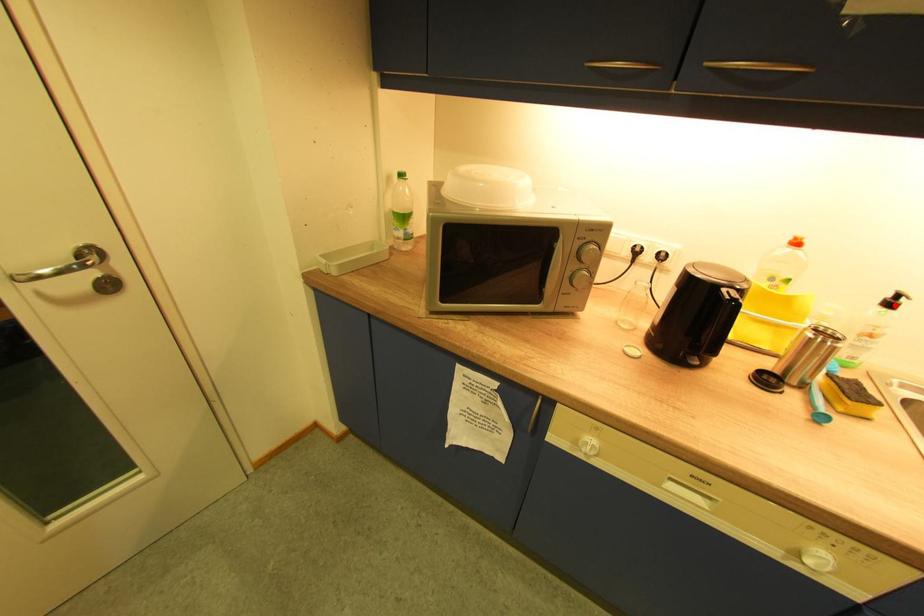
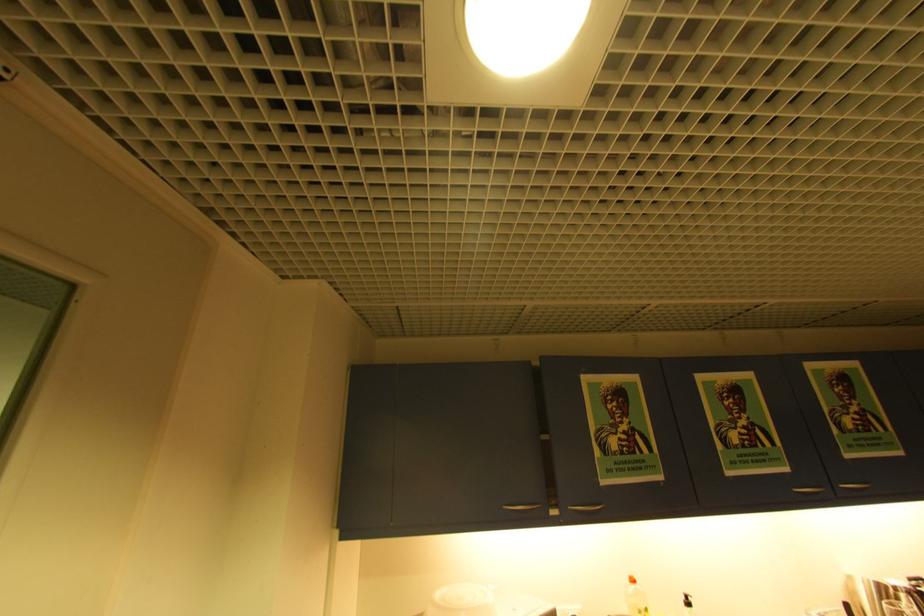
Question: I am providing you with two images of the same scene from different viewpoints. Given a red point in image1, look at the same physical point in image2. Is it:

Choices:
 (A) Closer to the viewpoint
 (B) Farther from the viewpoint

Answer: (A)